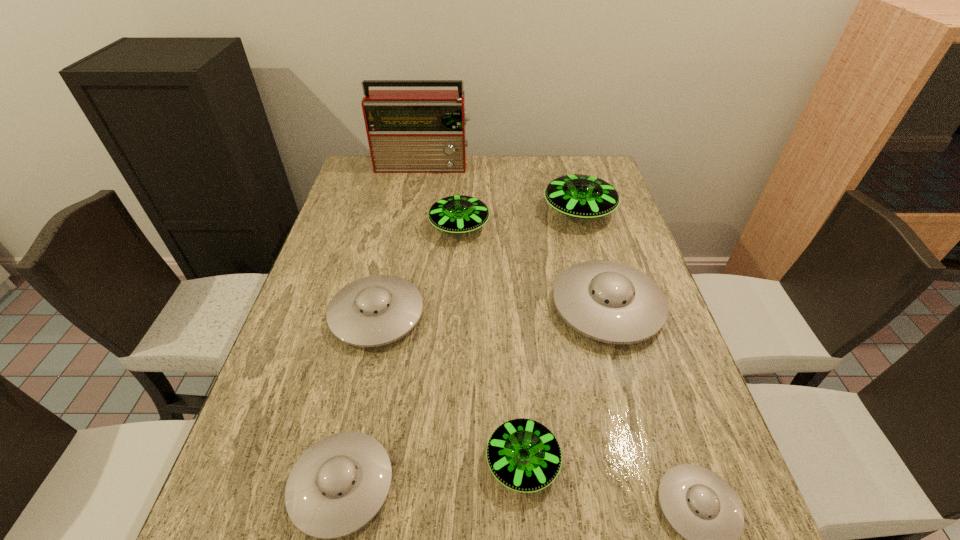
Identify the location of vacant space at the near edge of the desktop. (414, 534).

This screenshot has width=960, height=540. In the image, there is a desktop. In order to click on free region at the left edge in this screenshot , I will do (349, 283).

Where is `vacant region at the right edge`? vacant region at the right edge is located at coordinates (644, 433).

Locate an element on the screen. The height and width of the screenshot is (540, 960). vacant space at the far right corner of the desktop is located at coordinates coord(595,165).

The width and height of the screenshot is (960, 540). Identify the location of vacant point located between the biggest gray saucer and the nearest green saucer. (564, 384).

You are a GUI agent. You are given a task and a screenshot of the screen. Output one action in this format:
    pyautogui.click(x=<x>, y=<y>)
    Task: Click on the free space between the biggest green saucer and the tallest object
    
    Given the screenshot: What is the action you would take?
    pyautogui.click(x=501, y=188)

This screenshot has width=960, height=540. Find the location of `free space between the smallest green saucer and the biggest gray saucer`. free space between the smallest green saucer and the biggest gray saucer is located at coordinates (564, 384).

Identify the location of vacant region between the biggest gray saucer and the tallest object. This screenshot has height=540, width=960. (516, 236).

The image size is (960, 540). In order to click on vacant space that's between the biggest gray saucer and the nearest green saucer in this screenshot , I will do `click(564, 384)`.

Identify the location of free space between the radio receiver and the biggest gray saucer. The image size is (960, 540). (516, 236).